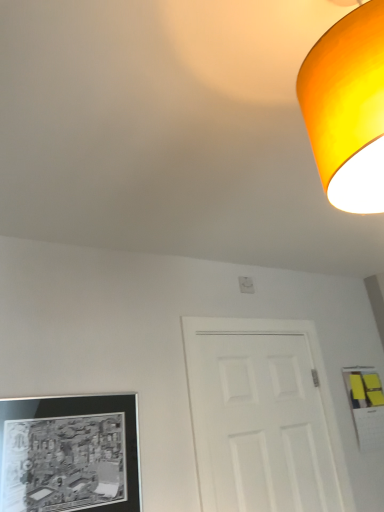
Measure the distance between point (365, 113) and camera.

The depth of point (365, 113) is 21.57 inches.

Locate an element on the screen. The image size is (384, 512). white matte door at center is located at coordinates (260, 416).

The width and height of the screenshot is (384, 512). I want to click on black matte picture frame at lower left, so click(x=70, y=454).

Locate an element on the screen. Image resolution: width=384 pixels, height=512 pixels. matte orange lampshade at upper right is located at coordinates (348, 109).

Are black matte picture frame at lower left and white matte door at center making contact?

No, black matte picture frame at lower left is not touching white matte door at center.

Is black matte picture frame at lower left closer to the viewer compared to white matte door at center?

Yes.

In the image, is black matte picture frame at lower left on the left side or the right side of white matte door at center?

Based on their positions, black matte picture frame at lower left is located to the left of white matte door at center.

From the image's perspective, which is below, matte orange lampshade at upper right or white matte door at center?

white matte door at center appears lower in the image.

What's the angular difference between matte orange lampshade at upper right and white matte door at center's facing directions?

The facing directions of matte orange lampshade at upper right and white matte door at center are 83.4 degrees apart.

Is white matte door at center a part of matte orange lampshade at upper right?

No, white matte door at center is not a part of matte orange lampshade at upper right.

From a real-world perspective, between matte orange lampshade at upper right and white matte door at center, who is vertically higher?

matte orange lampshade at upper right.

Can you confirm if white matte door at center is taller than black matte picture frame at lower left?

Yes.

Can you tell me how much white matte door at center and black matte picture frame at lower left differ in facing direction?

The angular difference between white matte door at center and black matte picture frame at lower left is 0.251 degrees.

From the image's perspective, which is below, white matte door at center or black matte picture frame at lower left?

white matte door at center, from the image's perspective.

Is white matte door at center positioned with its back to black matte picture frame at lower left?

No, white matte door at center is not facing away from black matte picture frame at lower left.

Consider the image. From a real-world perspective, is white matte door at center below matte orange lampshade at upper right?

Indeed, from a real-world perspective, white matte door at center is positioned beneath matte orange lampshade at upper right.

Is white matte door at center at the right side of matte orange lampshade at upper right?

Yes, white matte door at center is to the right of matte orange lampshade at upper right.

From the image's perspective, is white matte door at center located above or below matte orange lampshade at upper right?

white matte door at center is below matte orange lampshade at upper right.

Is white matte door at center closer to the viewer compared to matte orange lampshade at upper right?

No, white matte door at center is further to the viewer.

Is matte orange lampshade at upper right surrounded by black matte picture frame at lower left?

No, matte orange lampshade at upper right is located outside of black matte picture frame at lower left.

Is black matte picture frame at lower left positioned with its back to matte orange lampshade at upper right?

That's not correct — black matte picture frame at lower left is not looking away from matte orange lampshade at upper right.

Where is `lamp in front of the black matte picture frame at lower left`? The height and width of the screenshot is (512, 384). lamp in front of the black matte picture frame at lower left is located at coordinates (348, 109).

Does matte orange lampshade at upper right have a greater width compared to black matte picture frame at lower left?

Correct, the width of matte orange lampshade at upper right exceeds that of black matte picture frame at lower left.

Identify the location of picture frame on the left of matte orange lampshade at upper right. This screenshot has width=384, height=512. (70, 454).

From a real-world perspective, between matte orange lampshade at upper right and black matte picture frame at lower left, who is vertically lower?

black matte picture frame at lower left, from a real-world perspective.

Can you confirm if matte orange lampshade at upper right is positioned to the right of black matte picture frame at lower left?

Correct, you'll find matte orange lampshade at upper right to the right of black matte picture frame at lower left.

Identify the location of door positioned vertically above the black matte picture frame at lower left (from a real-world perspective). (260, 416).

At what (x,y) coordinates should I click in order to perform the action: click on door to the right of matte orange lampshade at upper right. Please return your answer as a coordinate pair (x, y). The image size is (384, 512). Looking at the image, I should click on (260, 416).

Estimate the real-world distances between objects in this image. Which object is further from matte orange lampshade at upper right, black matte picture frame at lower left or white matte door at center?

white matte door at center is further to matte orange lampshade at upper right.

Which object lies further to the anchor point black matte picture frame at lower left, matte orange lampshade at upper right or white matte door at center?

Among the two, matte orange lampshade at upper right is located further to black matte picture frame at lower left.

Looking at the image, which one is located further to white matte door at center, matte orange lampshade at upper right or black matte picture frame at lower left?

The object further to white matte door at center is matte orange lampshade at upper right.

Which object lies further to the anchor point black matte picture frame at lower left, white matte door at center or matte orange lampshade at upper right?

matte orange lampshade at upper right.

From the image, which object appears to be nearer to white matte door at center, black matte picture frame at lower left or matte orange lampshade at upper right?

black matte picture frame at lower left is positioned closer to the anchor white matte door at center.

When comparing their distances from matte orange lampshade at upper right, does white matte door at center or black matte picture frame at lower left seem further?

white matte door at center.

The width and height of the screenshot is (384, 512). In order to click on picture frame between matte orange lampshade at upper right and white matte door at center from top to bottom in this screenshot , I will do `click(70, 454)`.